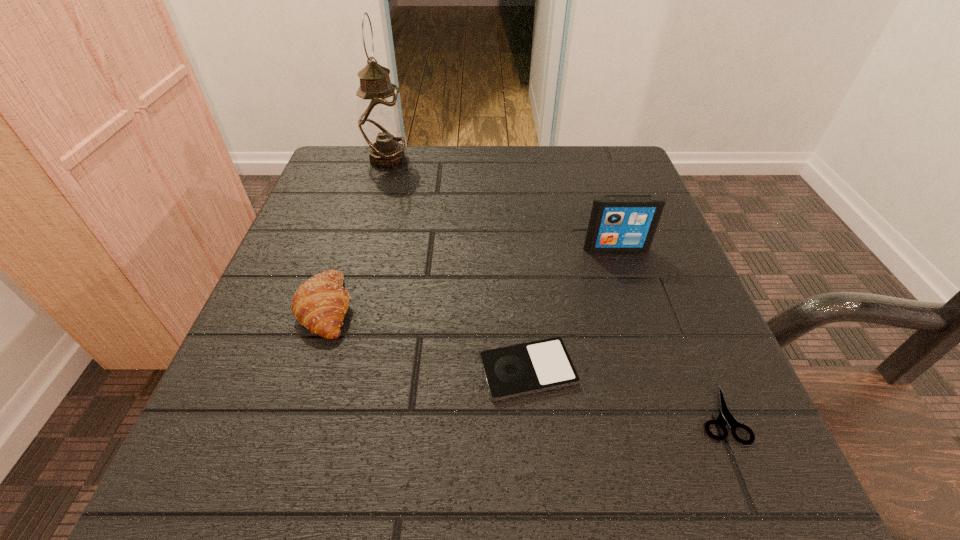
Where is `free space that satisfies the following two spatial constraints: 1. on the front side of the third shortest object; 2. on the left side of the shears`? The width and height of the screenshot is (960, 540). free space that satisfies the following two spatial constraints: 1. on the front side of the third shortest object; 2. on the left side of the shears is located at coordinates (291, 414).

Locate an element on the screen. The image size is (960, 540). vacant position in the image that satisfies the following two spatial constraints: 1. on the front side of the tallest object; 2. on the right side of the shortest object is located at coordinates (314, 414).

The height and width of the screenshot is (540, 960). Identify the location of vacant area that satisfies the following two spatial constraints: 1. on the front screen of the shortest object; 2. on the left side of the taller iPod. (671, 414).